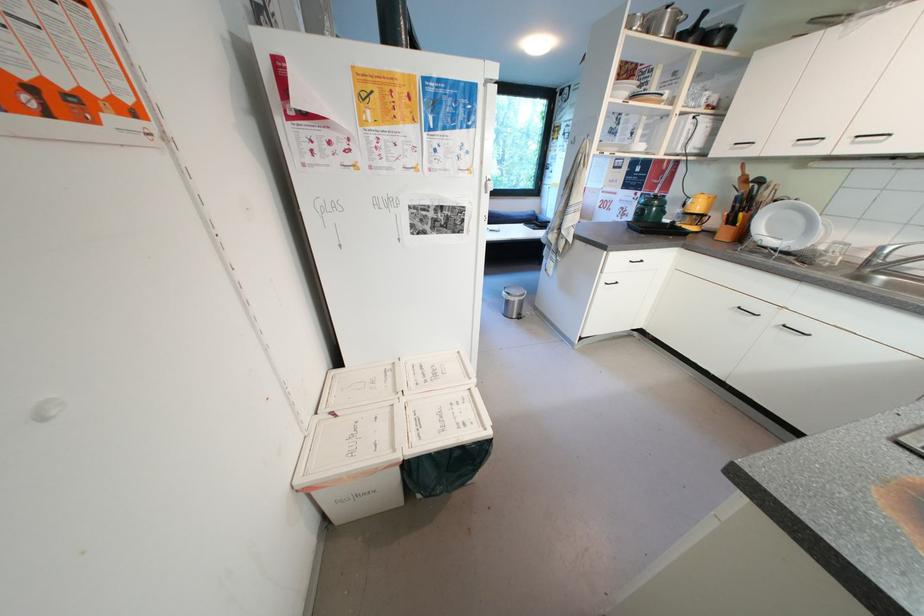
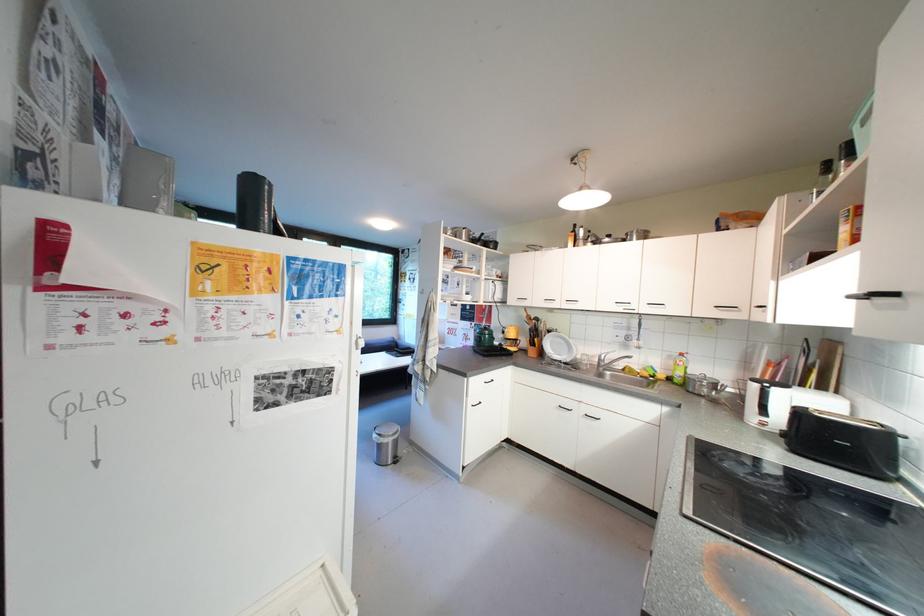
In the second image, find the point that corresponds to (749,238) in the first image.

(550, 355)